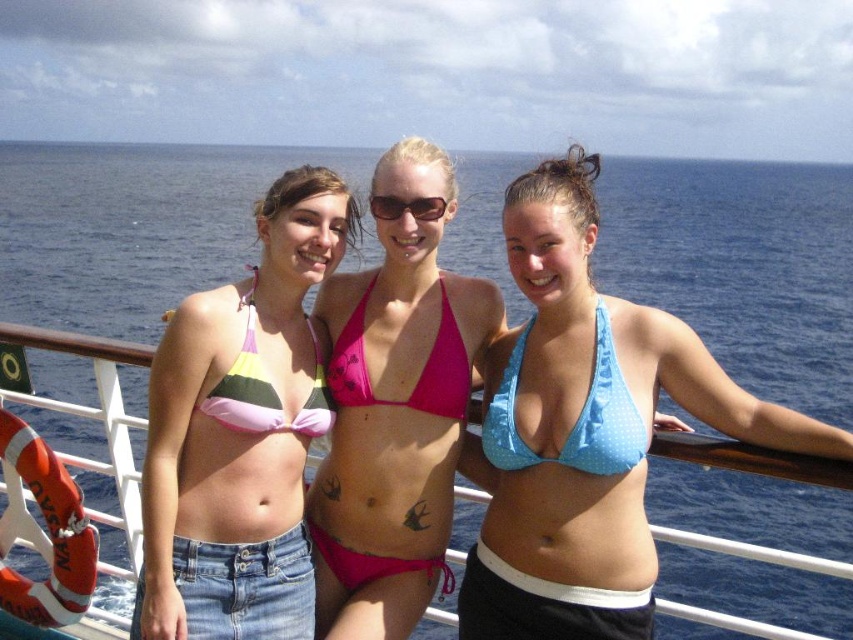
Can you confirm if metallic silver boat at center is positioned below striped fabric bikini top at center?

Yes, metallic silver boat at center is below striped fabric bikini top at center.

Does metallic silver boat at center appear on the right side of striped fabric bikini top at center?

In fact, metallic silver boat at center is to the left of striped fabric bikini top at center.

The height and width of the screenshot is (640, 853). In order to click on metallic silver boat at center in this screenshot , I will do `click(93, 413)`.

Which is more to the left, pink fabric bikini top at center or striped fabric bikini top at center?

striped fabric bikini top at center is more to the left.

Describe the element at coordinates (418, 376) in the screenshot. I see `pink fabric bikini top at center` at that location.

Locate an element on the screen. The width and height of the screenshot is (853, 640). pink fabric bikini top at center is located at coordinates (418, 376).

Image resolution: width=853 pixels, height=640 pixels. Describe the element at coordinates (393, 412) in the screenshot. I see `pink fabric bikini at center` at that location.

Who is higher up, pink fabric bikini at center or striped fabric bikini top at center?

striped fabric bikini top at center is higher up.

Measure the distance between point (451, 435) and camera.

A distance of 8.38 meters exists between point (451, 435) and camera.

Find the location of `pink fabric bikini at center`. pink fabric bikini at center is located at coordinates (393, 412).